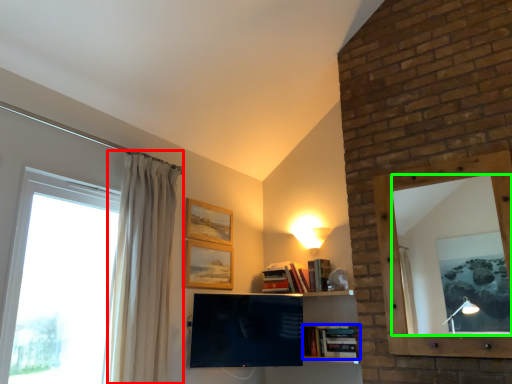
Question: Which object is positioned closest to curtain (highlighted by a red box)? Select from book (highlighted by a blue box) and mirror (highlighted by a green box).

Choices:
 (A) book
 (B) mirror

Answer: (A)